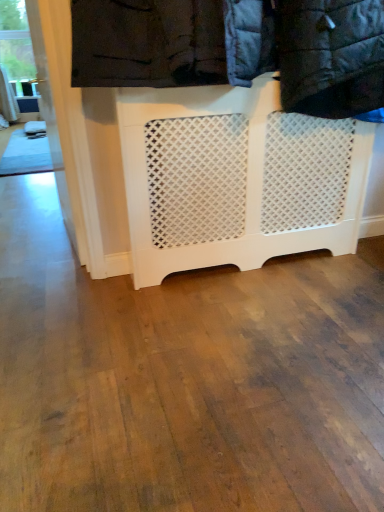
In order to click on free space in front of white lattice radiator at center in this screenshot , I will do 253,339.